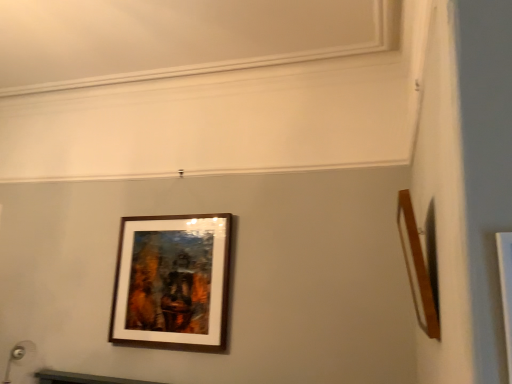
Identify the location of wooden frame at right, placed as the first picture frame when sorted from front to back. The height and width of the screenshot is (384, 512). (416, 267).

The image size is (512, 384). What do you see at coordinates (416, 267) in the screenshot?
I see `wooden frame at right, which is the 1th picture frame in right-to-left order` at bounding box center [416, 267].

What is the approximate width of wooden frame at right, the 2th picture frame in the left-to-right sequence?

wooden frame at right, the 2th picture frame in the left-to-right sequence, is 4.47 inches wide.

At what (x,y) coordinates should I click in order to perform the action: click on wooden frame at center, which ranks as the 2th picture frame in front-to-back order. Please return your answer as a coordinate pair (x, y). The width and height of the screenshot is (512, 384). Looking at the image, I should click on (172, 282).

What do you see at coordinates (172, 282) in the screenshot? This screenshot has width=512, height=384. I see `wooden frame at center, positioned as the second picture frame in right-to-left order` at bounding box center [172, 282].

I want to click on wooden frame at right, the second picture frame positioned from the back, so click(416, 267).

Which is more to the right, wooden frame at right, which is the 1th picture frame in right-to-left order, or wooden frame at center, positioned as the second picture frame in right-to-left order?

Positioned to the right is wooden frame at right, which is the 1th picture frame in right-to-left order.

Is the depth of wooden frame at right, the second picture frame positioned from the back, greater than that of wooden frame at center, positioned as the second picture frame in right-to-left order?

No, it is not.

Looking at this image, which is less distant, (x=430, y=294) or (x=152, y=234)?

Clearly, point (x=430, y=294) is closer to the camera than point (x=152, y=234).

From the image's perspective, would you say wooden frame at right, the second picture frame positioned from the back, is positioned over wooden frame at center, positioned as the second picture frame in right-to-left order?

Indeed, from the image's perspective, wooden frame at right, the second picture frame positioned from the back, is shown above wooden frame at center, positioned as the second picture frame in right-to-left order.

From a real-world perspective, between wooden frame at right, the 2th picture frame in the left-to-right sequence, and wooden frame at center, which ranks as the 2th picture frame in front-to-back order, who is vertically higher?

wooden frame at right, the 2th picture frame in the left-to-right sequence.

Which object is wider, wooden frame at right, which is the 1th picture frame in right-to-left order, or wooden frame at center, positioned as the second picture frame in right-to-left order?

With larger width is wooden frame at right, which is the 1th picture frame in right-to-left order.

Consider the image. Considering the sizes of objects wooden frame at right, the 2th picture frame in the left-to-right sequence, and wooden frame at center, which ranks as the 2th picture frame in front-to-back order, in the image provided, who is taller, wooden frame at right, the 2th picture frame in the left-to-right sequence, or wooden frame at center, which ranks as the 2th picture frame in front-to-back order,?

Standing taller between the two is wooden frame at center, which ranks as the 2th picture frame in front-to-back order.

Who is bigger, wooden frame at right, the second picture frame positioned from the back, or wooden frame at center, positioned as the second picture frame in right-to-left order?

wooden frame at center, positioned as the second picture frame in right-to-left order, is bigger.

From the picture: Can we say wooden frame at right, placed as the first picture frame when sorted from front to back, lies outside wooden frame at center, which ranks as the 2th picture frame in front-to-back order?

wooden frame at right, placed as the first picture frame when sorted from front to back, is positioned outside wooden frame at center, which ranks as the 2th picture frame in front-to-back order.

Is wooden frame at right, the second picture frame positioned from the back, far away from wooden frame at center, which ranks as the 2th picture frame in front-to-back order?

Absolutely, wooden frame at right, the second picture frame positioned from the back, is distant from wooden frame at center, which ranks as the 2th picture frame in front-to-back order.

Is wooden frame at right, the 2th picture frame in the left-to-right sequence, turned away from wooden frame at center, which ranks as the 2th picture frame in front-to-back order?

No.

Can you tell me how much wooden frame at right, which is the 1th picture frame in right-to-left order, and wooden frame at center, which appears as the first picture frame when viewed from the back, differ in facing direction?

wooden frame at right, which is the 1th picture frame in right-to-left order, and wooden frame at center, which appears as the first picture frame when viewed from the back, are facing 89.9 degrees away from each other.

Could you measure the distance between wooden frame at right, placed as the first picture frame when sorted from front to back, and wooden frame at center, which ranks as the 2th picture frame in front-to-back order?

The distance of wooden frame at right, placed as the first picture frame when sorted from front to back, from wooden frame at center, which ranks as the 2th picture frame in front-to-back order, is 4.54 feet.

Where is `picture frame on the right of wooden frame at center, positioned as the second picture frame in right-to-left order`? picture frame on the right of wooden frame at center, positioned as the second picture frame in right-to-left order is located at coordinates (416, 267).

Which is more to the right, wooden frame at center, positioned as the second picture frame in right-to-left order, or wooden frame at right, placed as the first picture frame when sorted from front to back?

Positioned to the right is wooden frame at right, placed as the first picture frame when sorted from front to back.

Consider the image. Between wooden frame at center, which ranks as the 2th picture frame in front-to-back order, and wooden frame at right, which is the 1th picture frame in right-to-left order, which one is positioned in front?

wooden frame at right, which is the 1th picture frame in right-to-left order.

Is point (226, 277) more distant than point (406, 229)?

That is True.

From the image's perspective, is wooden frame at center, positioned as the second picture frame in right-to-left order, below wooden frame at right, the second picture frame positioned from the back?

Indeed, from the image's perspective, wooden frame at center, positioned as the second picture frame in right-to-left order, is shown beneath wooden frame at right, the second picture frame positioned from the back.

From a real-world perspective, which is physically above, wooden frame at center, positioned as the 1th picture frame in left-to-right order, or wooden frame at right, the second picture frame positioned from the back?

wooden frame at right, the second picture frame positioned from the back, is physically above.

In the scene shown: Does wooden frame at center, which ranks as the 2th picture frame in front-to-back order, have a lesser width compared to wooden frame at right, the 2th picture frame in the left-to-right sequence?

Yes, wooden frame at center, which ranks as the 2th picture frame in front-to-back order, is thinner than wooden frame at right, the 2th picture frame in the left-to-right sequence.

Considering the relative sizes of wooden frame at center, which appears as the first picture frame when viewed from the back, and wooden frame at right, which is the 1th picture frame in right-to-left order, in the image provided, is wooden frame at center, which appears as the first picture frame when viewed from the back, taller than wooden frame at right, which is the 1th picture frame in right-to-left order,?

Yes, wooden frame at center, which appears as the first picture frame when viewed from the back, is taller than wooden frame at right, which is the 1th picture frame in right-to-left order.

Considering the sizes of wooden frame at center, which appears as the first picture frame when viewed from the back, and wooden frame at right, placed as the first picture frame when sorted from front to back, in the image, is wooden frame at center, which appears as the first picture frame when viewed from the back, bigger or smaller than wooden frame at right, placed as the first picture frame when sorted from front to back,?

Considering their sizes, wooden frame at center, which appears as the first picture frame when viewed from the back, takes up more space than wooden frame at right, placed as the first picture frame when sorted from front to back.

Choose the correct answer: Is wooden frame at center, which ranks as the 2th picture frame in front-to-back order, inside wooden frame at right, the 2th picture frame in the left-to-right sequence, or outside it?

wooden frame at center, which ranks as the 2th picture frame in front-to-back order, cannot be found inside wooden frame at right, the 2th picture frame in the left-to-right sequence.

Are wooden frame at center, positioned as the second picture frame in right-to-left order, and wooden frame at right, placed as the first picture frame when sorted from front to back, making contact?

No, wooden frame at center, positioned as the second picture frame in right-to-left order, is not in contact with wooden frame at right, placed as the first picture frame when sorted from front to back.

Is wooden frame at right, which is the 1th picture frame in right-to-left order, at the back of wooden frame at center, positioned as the 1th picture frame in left-to-right order?

No, wooden frame at center, positioned as the 1th picture frame in left-to-right order,'s orientation is not away from wooden frame at right, which is the 1th picture frame in right-to-left order.

Can you tell me how much wooden frame at center, which ranks as the 2th picture frame in front-to-back order, and wooden frame at right, placed as the first picture frame when sorted from front to back, differ in facing direction?

89.9 degrees separate the facing orientations of wooden frame at center, which ranks as the 2th picture frame in front-to-back order, and wooden frame at right, placed as the first picture frame when sorted from front to back.

In order to click on picture frame above the wooden frame at center, which appears as the first picture frame when viewed from the back (from the image's perspective) in this screenshot , I will do `click(416, 267)`.

Where is `picture frame that appears below the wooden frame at right, placed as the first picture frame when sorted from front to back (from the image's perspective)`? This screenshot has width=512, height=384. picture frame that appears below the wooden frame at right, placed as the first picture frame when sorted from front to back (from the image's perspective) is located at coordinates (172, 282).

This screenshot has width=512, height=384. In order to click on picture frame above the wooden frame at center, positioned as the second picture frame in right-to-left order (from the image's perspective) in this screenshot , I will do `click(416, 267)`.